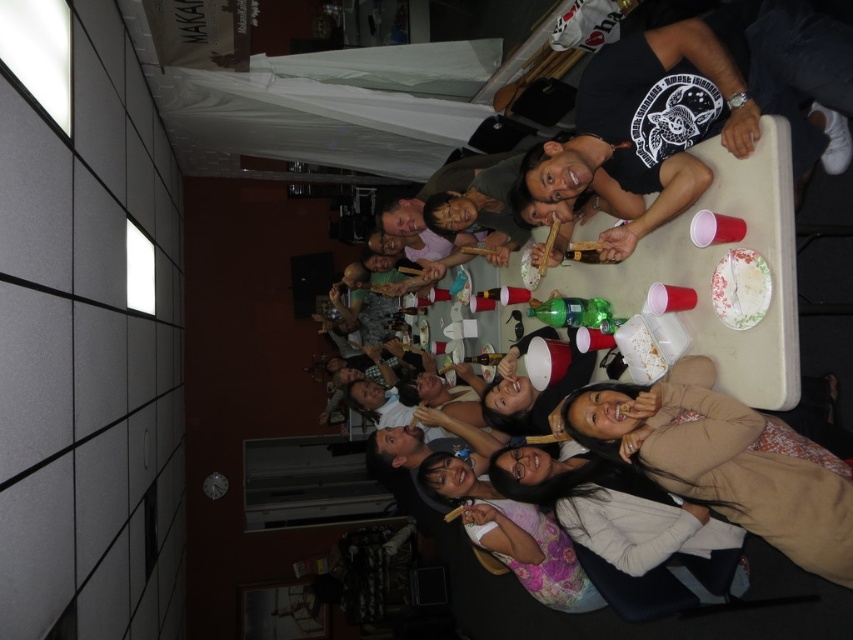
You are standing at the entrance of the room and want to move towards the two points marked in the image. Which point, point (759, 436) or point (753, 292), is closer to you?

Point (759, 436) is in front of point (753, 292), so it is closer to you.